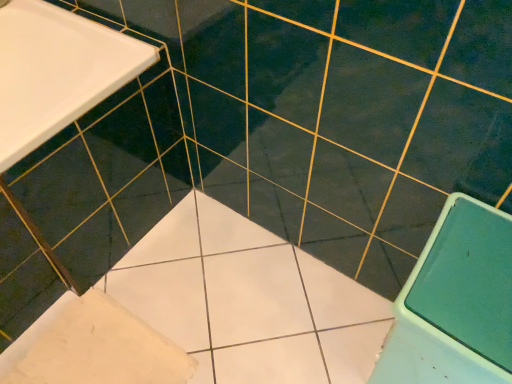
Find the location of a particular element. The image size is (512, 384). white matte tile at center is located at coordinates point(100,349).

The image size is (512, 384). What do you see at coordinates (100, 349) in the screenshot? I see `white matte tile at center` at bounding box center [100, 349].

Identify the location of white matte tile at center. Image resolution: width=512 pixels, height=384 pixels. (100, 349).